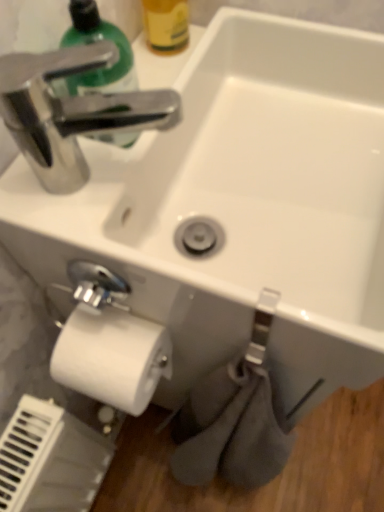
Question: Can you see shiny green plastic soap dispenser at upper left touching white matte toilet paper at lower left?

Choices:
 (A) no
 (B) yes

Answer: (A)

Question: Is the depth of shiny green plastic soap dispenser at upper left less than that of white matte toilet paper at lower left?

Choices:
 (A) no
 (B) yes

Answer: (B)

Question: From a real-world perspective, is shiny green plastic soap dispenser at upper left on white matte toilet paper at lower left?

Choices:
 (A) yes
 (B) no

Answer: (A)

Question: Can you confirm if shiny green plastic soap dispenser at upper left is positioned to the left of white matte toilet paper at lower left?

Choices:
 (A) yes
 (B) no

Answer: (A)

Question: Does shiny green plastic soap dispenser at upper left have a larger size compared to white matte toilet paper at lower left?

Choices:
 (A) yes
 (B) no

Answer: (B)

Question: Is shiny green plastic soap dispenser at upper left located outside white matte toilet paper at lower left?

Choices:
 (A) yes
 (B) no

Answer: (A)

Question: Is yellow matte bottle at upper center positioned behind white matte toilet paper at lower left?

Choices:
 (A) no
 (B) yes

Answer: (B)

Question: Considering the relative positions of yellow matte bottle at upper center and white matte toilet paper at lower left in the image provided, is yellow matte bottle at upper center to the left of white matte toilet paper at lower left from the viewer's perspective?

Choices:
 (A) yes
 (B) no

Answer: (B)

Question: Is white matte toilet paper at lower left located within yellow matte bottle at upper center?

Choices:
 (A) no
 (B) yes

Answer: (A)

Question: Can you confirm if yellow matte bottle at upper center is bigger than white matte toilet paper at lower left?

Choices:
 (A) no
 (B) yes

Answer: (A)

Question: From a real-world perspective, is yellow matte bottle at upper center below white matte toilet paper at lower left?

Choices:
 (A) no
 (B) yes

Answer: (A)

Question: Are yellow matte bottle at upper center and white matte toilet paper at lower left beside each other?

Choices:
 (A) no
 (B) yes

Answer: (A)

Question: Are shiny green plastic soap dispenser at upper left and yellow matte bottle at upper center making contact?

Choices:
 (A) yes
 (B) no

Answer: (B)